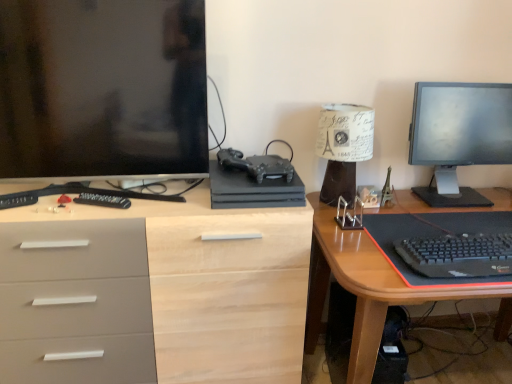
I want to click on vacant space that is to the left of matte black gaming console at center, so click(x=166, y=195).